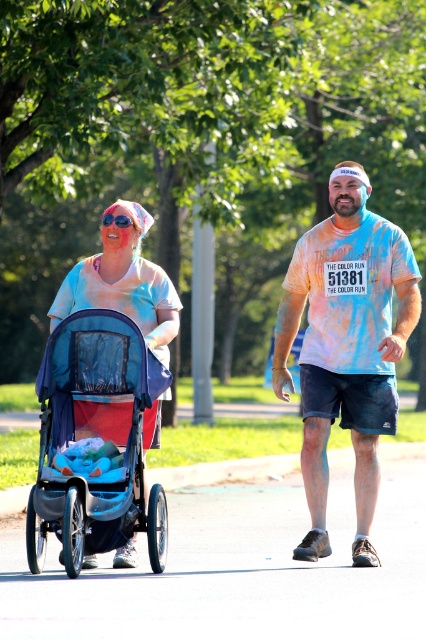
Question: Is white rubber stroller at lower left wider than blue fabric stroller at left?

Choices:
 (A) yes
 (B) no

Answer: (A)

Question: Is the position of paint-splattered t-shirt at center less distant than that of speckled tie-dye t-shirt at center?

Choices:
 (A) yes
 (B) no

Answer: (A)

Question: Which of the following is the closest to the observer?

Choices:
 (A) (158, 602)
 (B) (365, 544)
 (C) (317, 499)

Answer: (A)

Question: Is white rubber stroller at lower left to the right of speckled tie-dye t-shirt at center from the viewer's perspective?

Choices:
 (A) yes
 (B) no

Answer: (B)

Question: Which object is the closest to the white rubber stroller at lower left?

Choices:
 (A) blue fabric stroller at left
 (B) speckled tie-dye t-shirt at center

Answer: (A)

Question: Among these points, which one is nearest to the camera?

Choices:
 (A) 242,538
 (B) 359,316

Answer: (B)